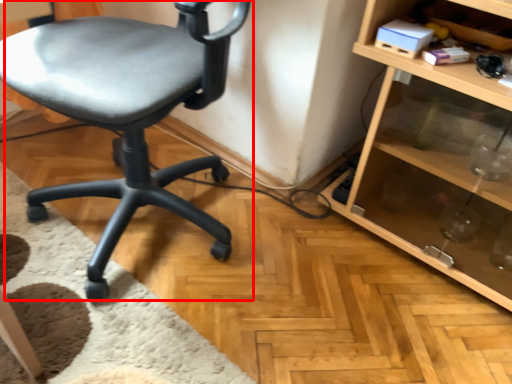
Question: Where is chair (annotated by the red box) located in relation to shelf in the image?

Choices:
 (A) left
 (B) right

Answer: (A)